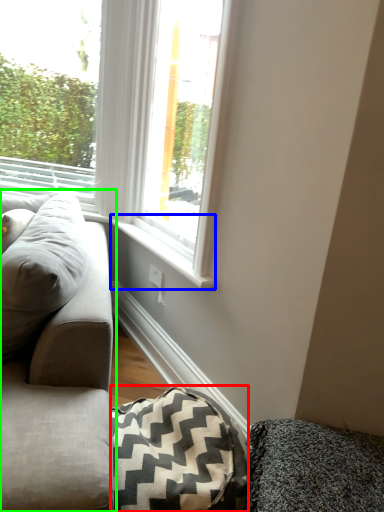
Question: Which object is positioned closest to blanket (highlighted by a red box)? Select from window sill (highlighted by a blue box) and studio couch (highlighted by a green box).

Choices:
 (A) window sill
 (B) studio couch

Answer: (B)